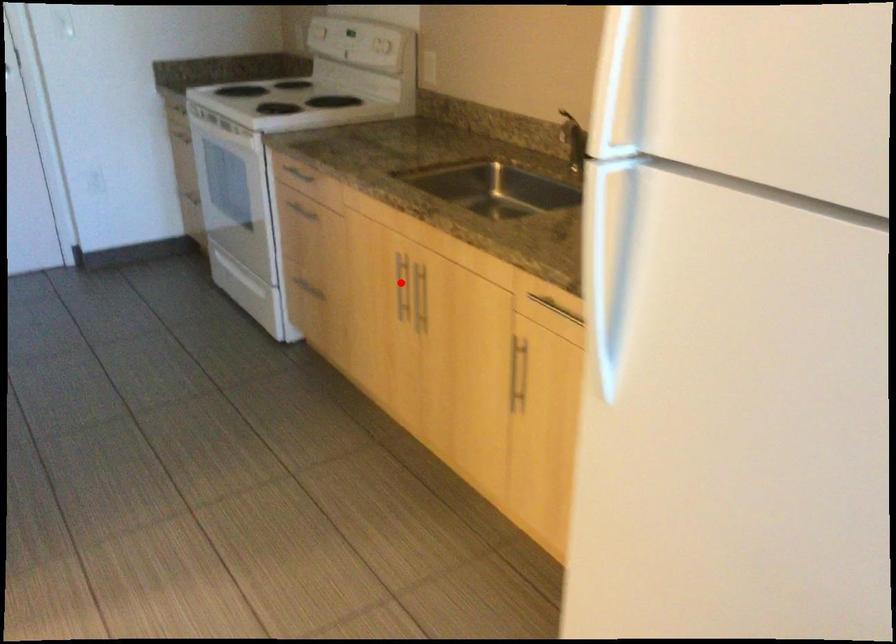
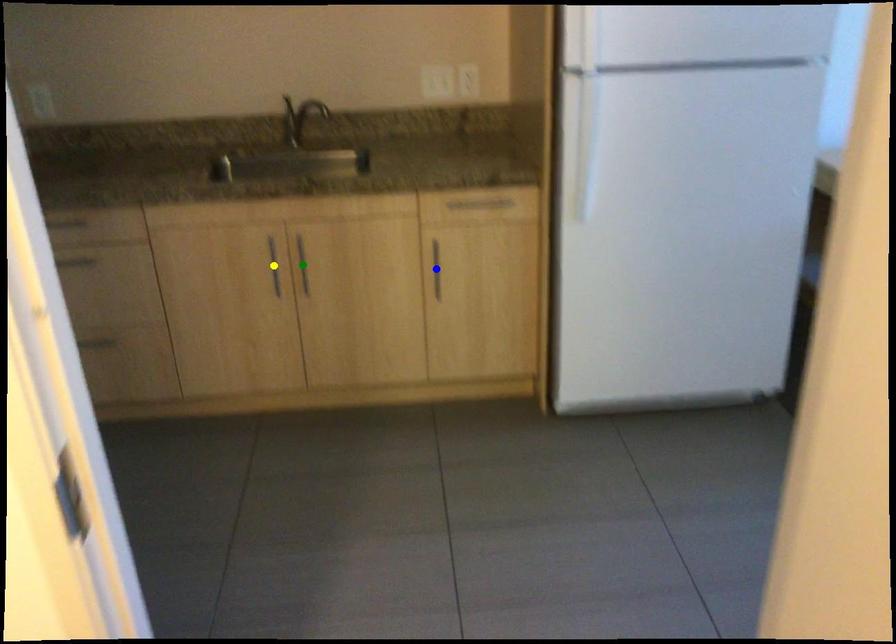
Question: I am providing you with two images of the same scene from different viewpoints. A red point is marked on the first image. You are given multiple points on the second image. Which point in image 2 represents the same 3d spot as the red point in image 1?

Choices:
 (A) yellow point
 (B) blue point
 (C) green point

Answer: (A)